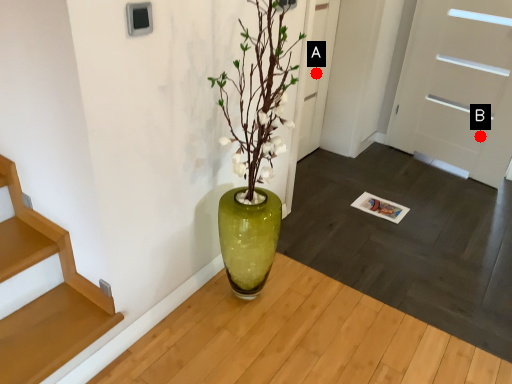
Question: Two points are circled on the image, labeled by A and B beside each circle. Among these points, which one is farthest from the camera?

Choices:
 (A) A is further
 (B) B is further

Answer: (B)